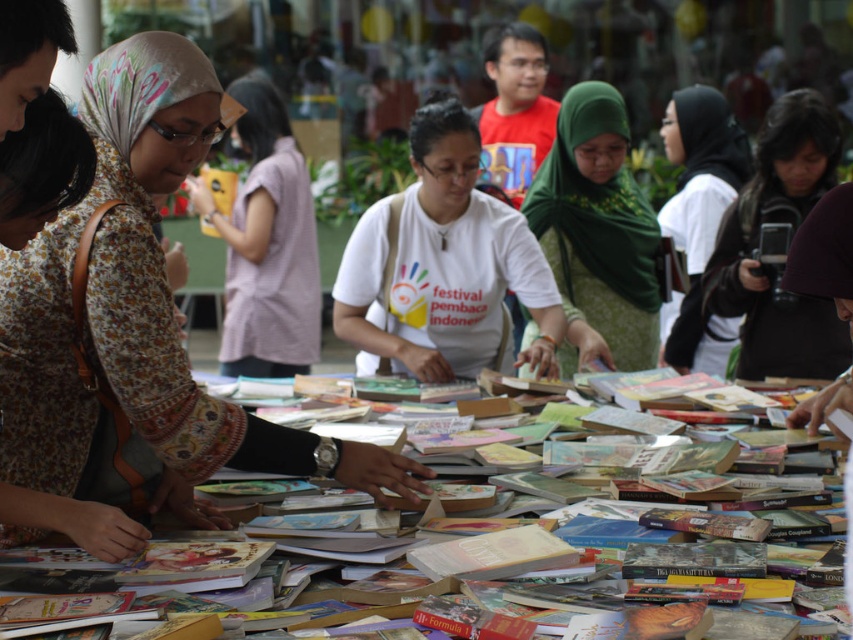
You are standing at the book fair and want to take a photo of both points mentioned. Since you can only focus on one point at a time, which point should you focus on first to ensure the other is still in focus? Please choose between point (166, 136) and point (30, 500).

You should focus on point (166, 136) first because it is closer to the camera than point (30, 500). By focusing on the closer point, the depth of field may still include the farther point in acceptable focus.